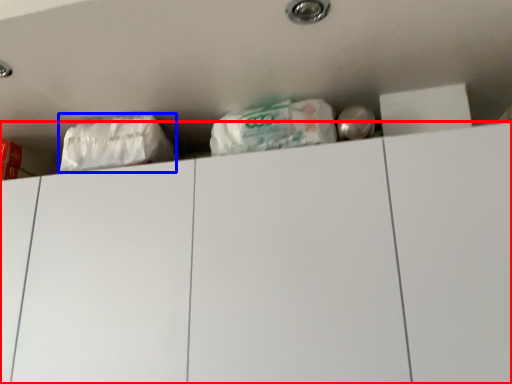
Question: Which object appears closest to the camera in this image, drawer (highlighted by a red box) or plastic bag (highlighted by a blue box)?

Choices:
 (A) drawer
 (B) plastic bag

Answer: (A)